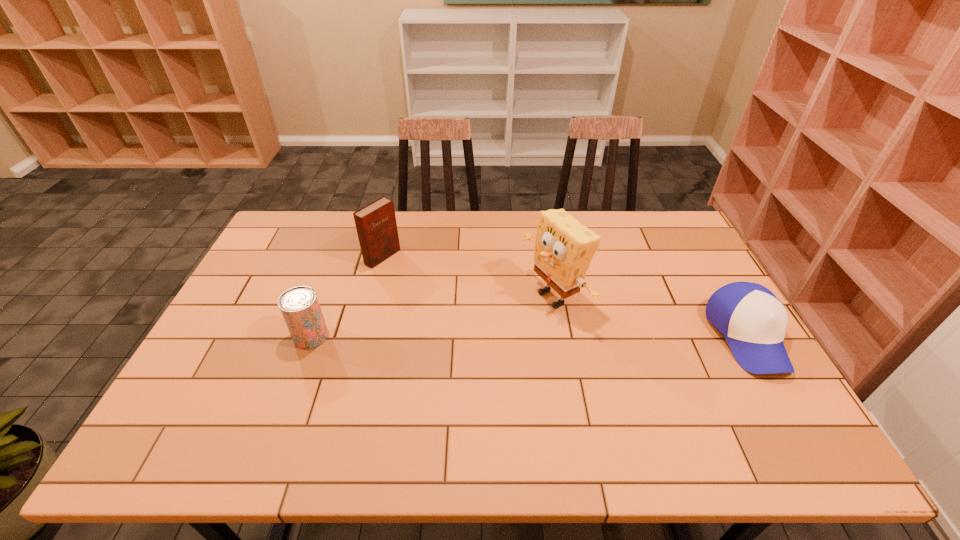
Locate an element on the screen. vacant spot on the desktop that is between the leftmost object and the shortest object and is positioned on the front cover of the diary is located at coordinates (520, 336).

The image size is (960, 540). Find the location of `free space on the desktop that is between the leftmost object and the shortest object and is positioned on the face of the tallest object`. free space on the desktop that is between the leftmost object and the shortest object and is positioned on the face of the tallest object is located at coordinates (470, 336).